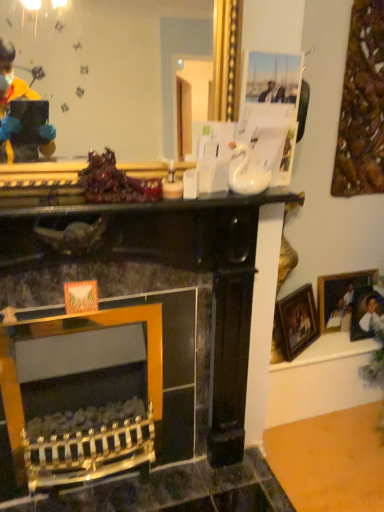
Question: Is point (134, 192) positioned closer to the camera than point (142, 46)?

Choices:
 (A) farther
 (B) closer

Answer: (B)

Question: Is shiny purple grapes at center situated inside gold metallic mirror at upper center or outside?

Choices:
 (A) outside
 (B) inside

Answer: (A)

Question: Which object is the closest to the shiny purple grapes at center?

Choices:
 (A) gold metallic mirror at upper center
 (B) wooden picture frame at right, acting as the 1th picture frame starting from the right
 (C) gold-framed picture at right, the first picture frame when ordered from left to right

Answer: (A)

Question: Which object is positioned closest to the gold-framed picture at right, the first picture frame when ordered from left to right?

Choices:
 (A) shiny purple grapes at center
 (B) wooden picture frame at right, which is the 2th picture frame in left-to-right order
 (C) gold metallic mirror at upper center

Answer: (B)